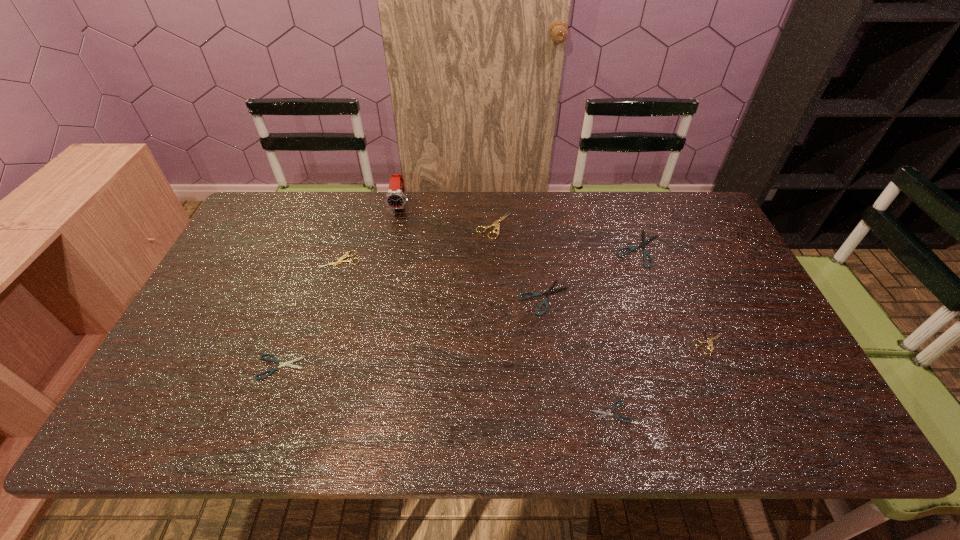
I want to click on vacant region located 0.090m on the back of the fourth nearest shears, so point(539,258).

At what (x,y) coordinates should I click in order to perform the action: click on vacant area located on the front of the rightmost beige shears. Please return your answer as a coordinate pair (x, y). Looking at the image, I should click on click(725, 376).

The image size is (960, 540). I want to click on free point located 0.210m on the left of the second nearest black shears, so tap(170, 367).

Locate an element on the screen. This screenshot has width=960, height=540. vacant area situated 0.090m on the right of the nearest black shears is located at coordinates coord(669,411).

The image size is (960, 540). What are the coordinates of `watch that is at the far edge` in the screenshot? It's located at (395, 198).

You are a GUI agent. You are given a task and a screenshot of the screen. Output one action in this format:
    pyautogui.click(x=<x>, y=<y>)
    Task: Click on the object situated at the near edge
    The image size is (960, 540).
    Given the screenshot: What is the action you would take?
    pyautogui.click(x=604, y=413)

The height and width of the screenshot is (540, 960). I want to click on object that is at the right edge, so click(709, 340).

At what (x,y) coordinates should I click in order to perform the action: click on vacant space at the far edge. Please return your answer as a coordinate pair (x, y). This screenshot has height=540, width=960. Looking at the image, I should click on (473, 229).

In the image, there is a desktop. Find the location of `free space at the near edge`. free space at the near edge is located at coordinates point(688,414).

Find the location of a particular element. This screenshot has width=960, height=540. free space at the left edge is located at coordinates (258, 260).